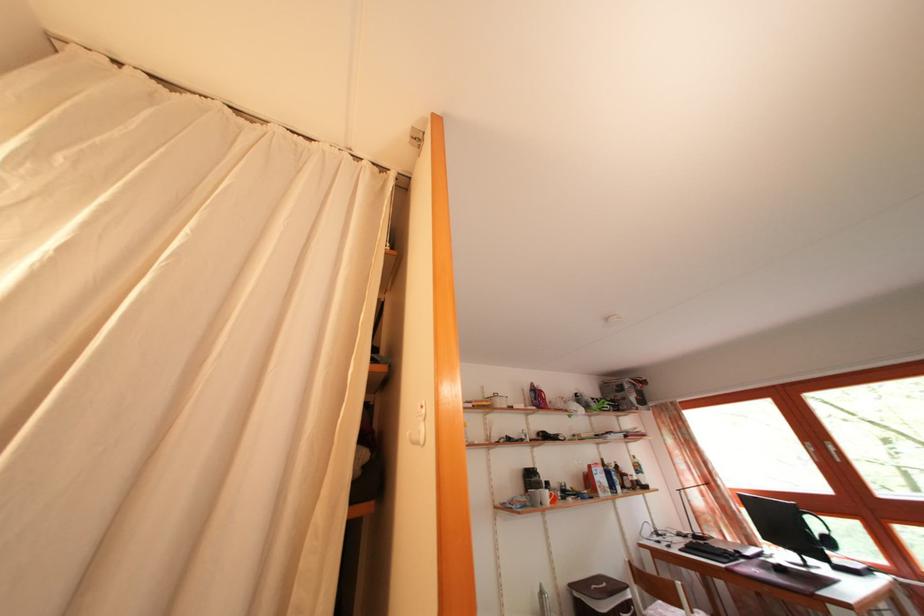
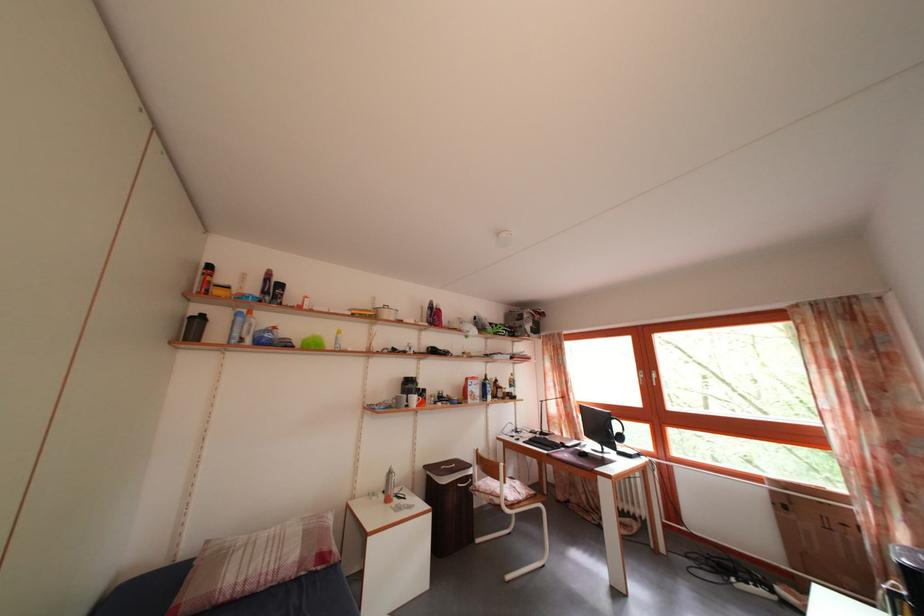
Where in the second image is the point corresponding to pixel 823 455 from the first image?

(652, 382)